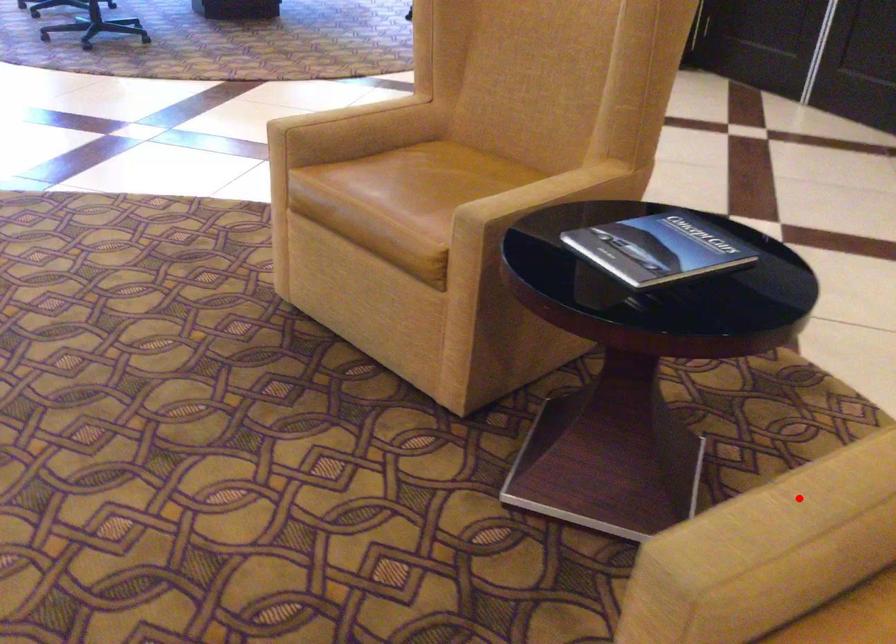
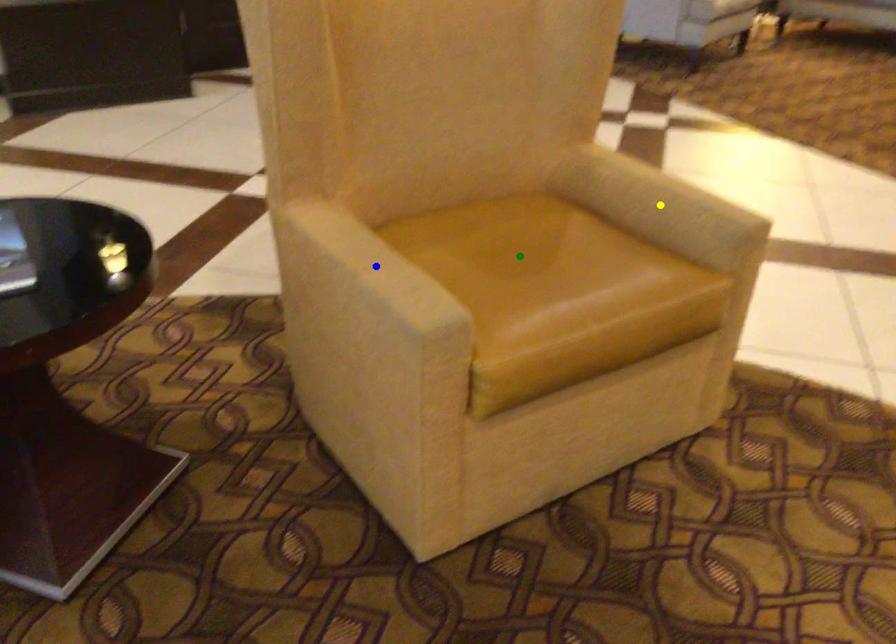
Question: I am providing you with two images of the same scene from different viewpoints. A red point is marked on the first image. You are given multiple points on the second image. Which mark in image 2 goes with the point in image 1?

Choices:
 (A) blue point
 (B) yellow point
 (C) green point

Answer: (A)